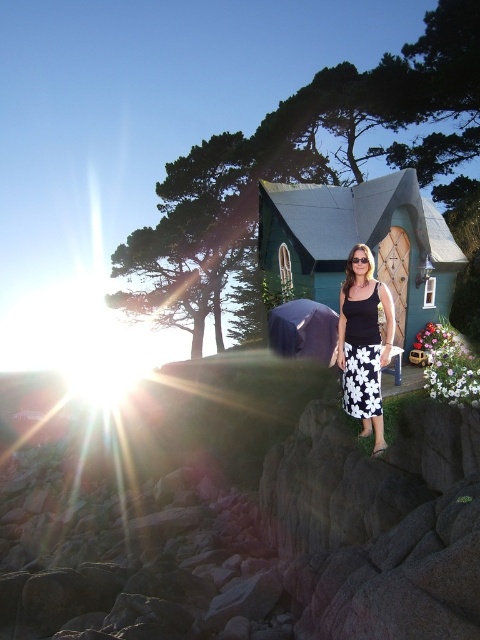
Question: Does gray rock at lower center have a larger size compared to black printed skirt at center?

Choices:
 (A) yes
 (B) no

Answer: (A)

Question: Is gray rock at lower center to the left of black floral skirt at center from the viewer's perspective?

Choices:
 (A) yes
 (B) no

Answer: (A)

Question: Which of these objects is positioned farthest from the black printed skirt at center?

Choices:
 (A) gray rock at lower center
 (B) black floral skirt at center

Answer: (A)

Question: Which point is closer to the camera?

Choices:
 (A) (367, 262)
 (B) (359, 364)
 (C) (477, 477)

Answer: (C)

Question: Which object is farther from the camera taking this photo?

Choices:
 (A) black floral skirt at center
 (B) black printed skirt at center

Answer: (A)

Question: Is gray rock at lower center to the left of black printed skirt at center from the viewer's perspective?

Choices:
 (A) no
 (B) yes

Answer: (B)